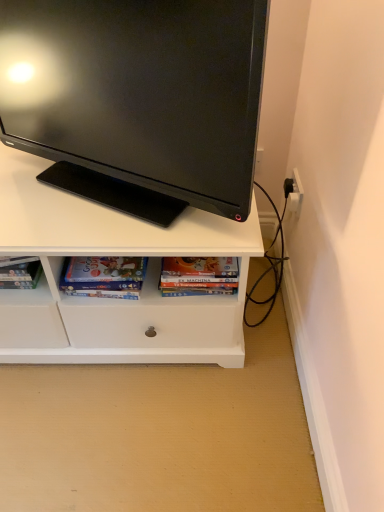
Question: From the image's perspective, is matte black monitor at upper center positioned above or below hardcover book at center, acting as the 1th book starting from the right?

Choices:
 (A) below
 (B) above

Answer: (B)

Question: In terms of width, does matte black monitor at upper center look wider or thinner when compared to hardcover book at center, acting as the 1th book starting from the right?

Choices:
 (A) wide
 (B) thin

Answer: (A)

Question: Estimate the real-world distances between objects in this image. Which object is closer to the hardcover book at center, the second book positioned from the left?

Choices:
 (A) matte black monitor at upper center
 (B) matte cardboard book at lower center, the first book from the left

Answer: (B)

Question: Which of these objects is positioned farthest from the matte black monitor at upper center?

Choices:
 (A) matte cardboard book at lower center, the first book from the left
 (B) hardcover book at center, acting as the 1th book starting from the right

Answer: (B)